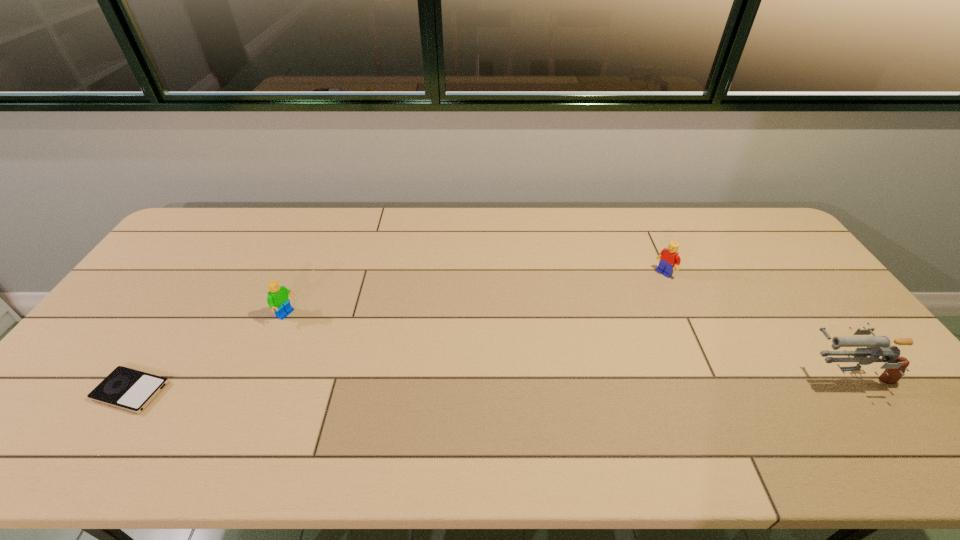
In order to click on vacant space on the desktop that is between the shortest object and the rightmost object and is positioned on the face of the second object from left to right in this screenshot , I will do `click(419, 384)`.

The image size is (960, 540). I want to click on free space on the desktop that is between the shortest object and the gun and is positioned on the face of the farther Lego, so click(506, 382).